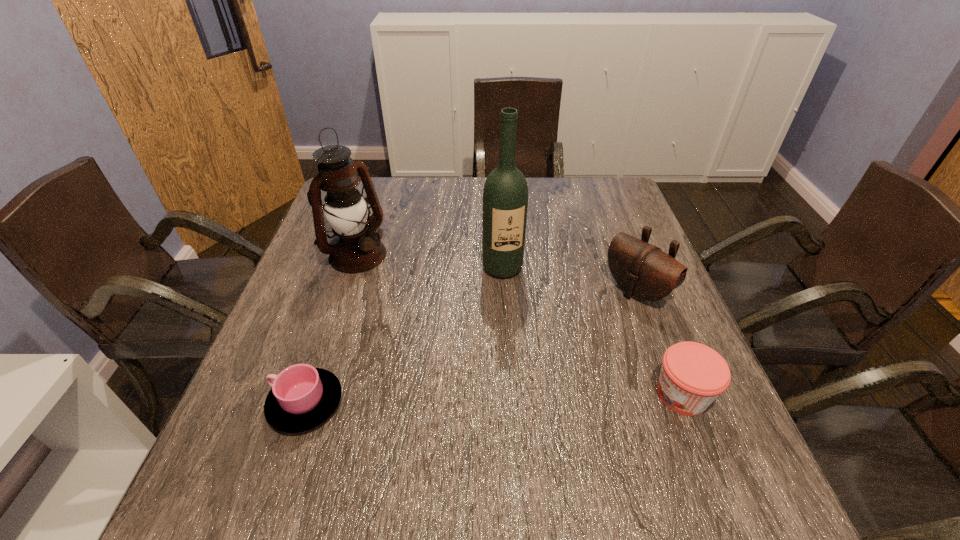
Find the location of `vacant space at the near right corner of the desktop`. vacant space at the near right corner of the desktop is located at coordinates (680, 417).

Where is `vacant area between the fourth shortest object and the wine bottle`? This screenshot has width=960, height=540. vacant area between the fourth shortest object and the wine bottle is located at coordinates (430, 261).

In order to click on free space between the lantern and the third object from right to left in this screenshot , I will do `click(430, 261)`.

The height and width of the screenshot is (540, 960). I want to click on free space that is in between the wine bottle and the second shortest object, so pos(592,331).

I want to click on free space between the wine bottle and the second shortest object, so click(592, 331).

The height and width of the screenshot is (540, 960). What are the coordinates of `free space between the cup and the second tallest object` in the screenshot? It's located at (331, 329).

At what (x,y) coordinates should I click in order to perform the action: click on vacant space in between the lantern and the third object from left to right. Please return your answer as a coordinate pair (x, y). Looking at the image, I should click on (430, 261).

This screenshot has width=960, height=540. In order to click on free space between the lantern and the second shortest object in this screenshot , I will do `click(519, 325)`.

Identify the location of free area in between the wine bottle and the fourth tallest object. (592, 331).

The image size is (960, 540). Find the location of `vacant area that lies between the lantern and the wine bottle`. vacant area that lies between the lantern and the wine bottle is located at coordinates (430, 261).